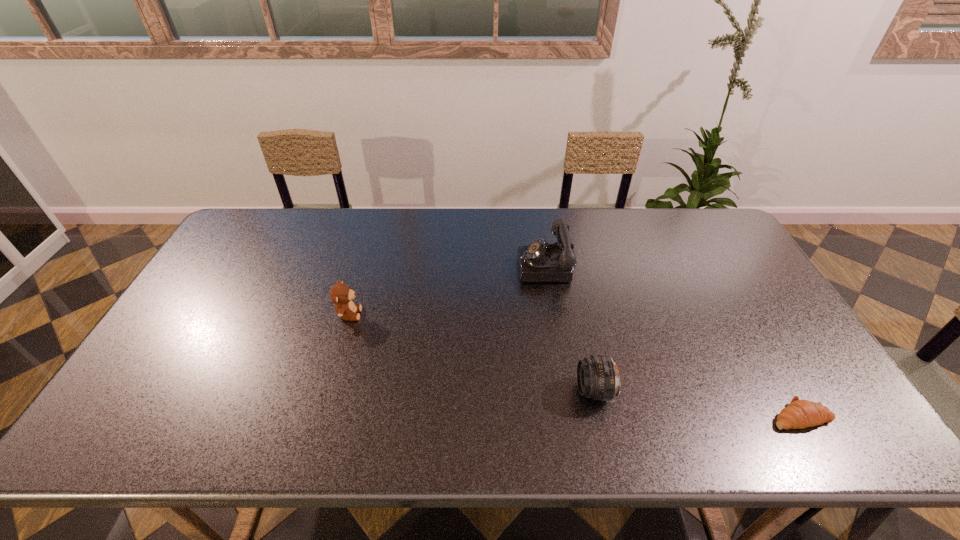
The width and height of the screenshot is (960, 540). I want to click on vacant region located 0.300m on the face of the teddy bear, so click(467, 314).

The width and height of the screenshot is (960, 540). What are the coordinates of `vacant point located at the front element of the telephoto lens` in the screenshot? It's located at (422, 390).

This screenshot has width=960, height=540. I want to click on free spot located 0.230m at the front element of the telephoto lens, so click(x=484, y=390).

Locate an element on the screen. The width and height of the screenshot is (960, 540). blank area located 0.360m at the front element of the telephoto lens is located at coordinates (430, 390).

Find the location of a particular element. free space located 0.300m on the left of the rightmost object is located at coordinates (641, 416).

Locate an element on the screen. object that is at the far edge is located at coordinates (540, 261).

Identify the location of object that is at the near edge. Image resolution: width=960 pixels, height=540 pixels. (799, 414).

The image size is (960, 540). I want to click on object situated at the right edge, so click(799, 414).

At what (x,y) coordinates should I click in order to perform the action: click on object positioned at the near right corner. Please return your answer as a coordinate pair (x, y). Looking at the image, I should click on (799, 414).

Locate an element on the screen. The image size is (960, 540). vacant region at the far edge is located at coordinates (627, 212).